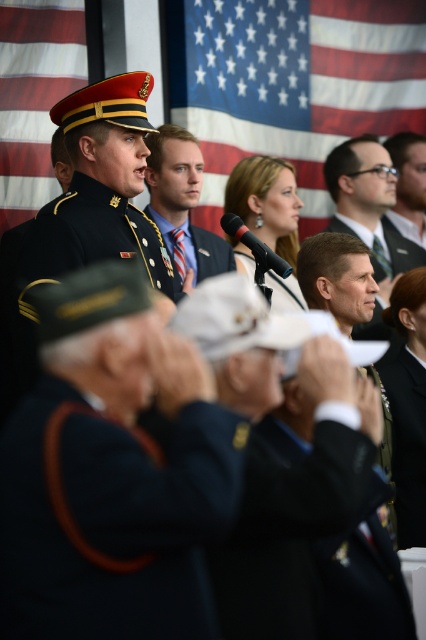
What is the relationship between the width of the blue fabric tie at center and the shiny gold buttons at center?

The blue fabric tie at center is wider than the shiny gold buttons at center according to the description.

You are a photographer at the event and need to adjust the lighting to highlight the blue fabric tie at center and the shiny gold buttons at center. Which object should you focus on first if you want to ensure the one higher up is properly lit?

The blue fabric tie at center is located above the shiny gold buttons at center, so you should focus on lighting the blue fabric tie at center first to ensure proper illumination of the higher object.